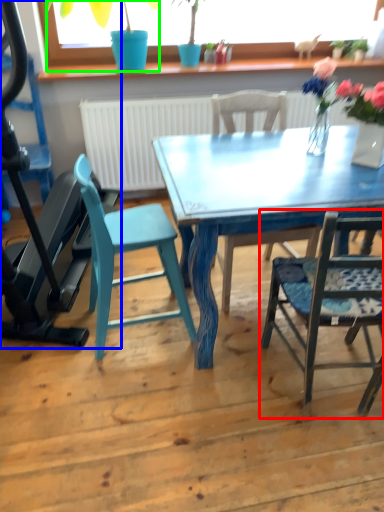
Question: Estimate the real-world distances between objects in this image. Which object is farther from chair (highlighted by a red box), treadmill (highlighted by a blue box) or houseplant (highlighted by a green box)?

Choices:
 (A) treadmill
 (B) houseplant

Answer: (B)